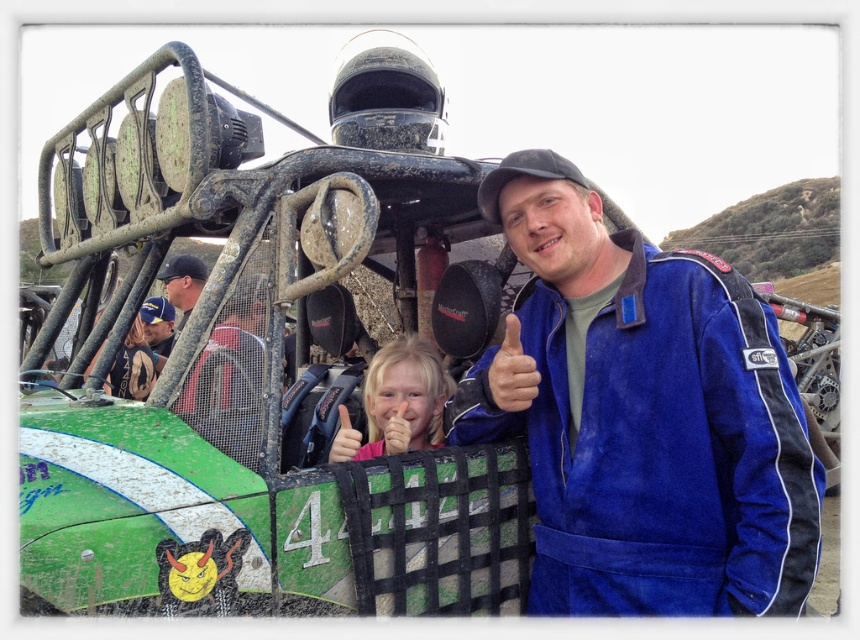
Does point (507, 340) come closer to viewer compared to point (341, 458)?

Yes, point (507, 340) is in front of point (341, 458).

Which is below, smooth skin hand at center or pink matte hand at center?

pink matte hand at center

Find the location of a particular element. smooth skin hand at center is located at coordinates (513, 371).

Can you confirm if matte black helmet at upper center is smaller than pink matte hand at center?

Actually, matte black helmet at upper center might be larger than pink matte hand at center.

From the picture: Who is positioned more to the right, matte black helmet at upper center or pink matte hand at center?

pink matte hand at center is more to the right.

Identify the location of matte black helmet at upper center. (182, 282).

I want to click on matte black helmet at upper center, so click(182, 282).

Describe the element at coordinates (645, 417) in the screenshot. The width and height of the screenshot is (860, 640). I see `blue suede jacket at center` at that location.

Is blue suede jacket at center bigger than blonde hair at center?

Indeed, blue suede jacket at center has a larger size compared to blonde hair at center.

Which is behind, point (576, 561) or point (347, 438)?

Positioned behind is point (347, 438).

This screenshot has width=860, height=640. In order to click on blue suede jacket at center in this screenshot , I will do `click(645, 417)`.